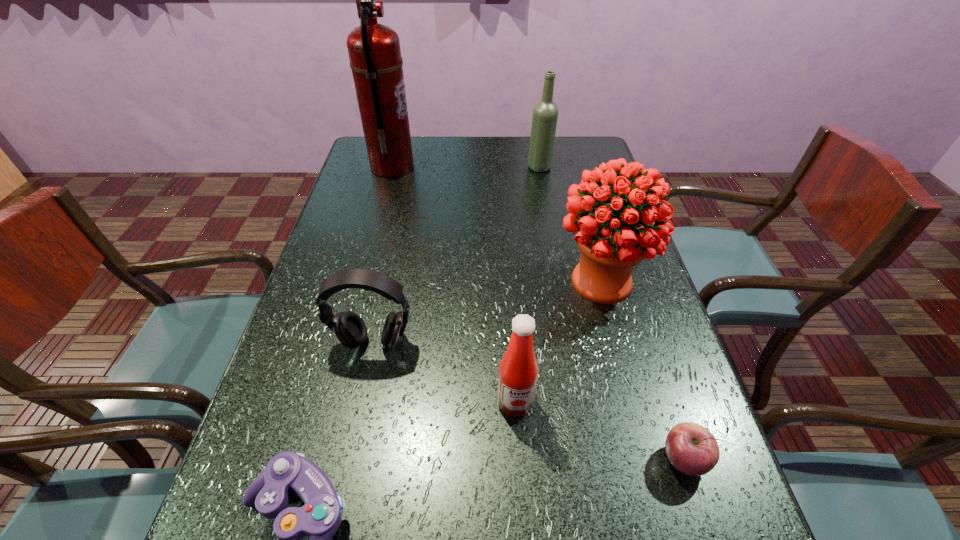
Locate an element on the screen. The image size is (960, 540). free space located 0.150m on the right of the wine bottle is located at coordinates (596, 167).

The image size is (960, 540). Identify the location of vacant position located on the front-facing side of the condiment. (518, 456).

Find the location of `blank space located on the ear cups of the fifth tallest object`. blank space located on the ear cups of the fifth tallest object is located at coordinates (357, 418).

Find the location of a particular element. Image resolution: width=960 pixels, height=540 pixels. vacant space situated on the back of the second shortest object is located at coordinates (629, 292).

This screenshot has width=960, height=540. I want to click on fire extinguisher that is at the far edge, so click(x=374, y=51).

Find the location of a particular element. wine bottle that is at the far edge is located at coordinates (545, 113).

The height and width of the screenshot is (540, 960). Find the location of `fire extinguisher located at the left edge`. fire extinguisher located at the left edge is located at coordinates (374, 51).

Find the location of a particular element. earphone that is at the left edge is located at coordinates (349, 328).

What are the coordinates of `bouquet that is at the right edge` in the screenshot? It's located at (611, 243).

The image size is (960, 540). I want to click on apple located at the right edge, so click(692, 449).